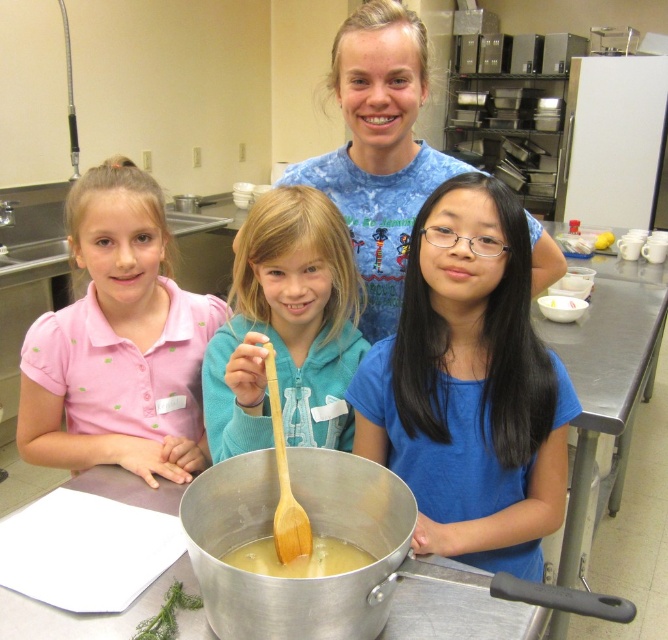
Is blue cotton shirt at upper center to the right of yellow matte liquid at center from the viewer's perspective?

Indeed, blue cotton shirt at upper center is positioned on the right side of yellow matte liquid at center.

Which is in front, point (411, 72) or point (277, 547)?

Point (277, 547) is more forward.

Identify the location of blue cotton shirt at upper center. (377, 148).

Does blue matte shirt at center appear over yellow matte cupcake at center?

No, blue matte shirt at center is not above yellow matte cupcake at center.

Does blue matte shirt at center lie behind yellow matte cupcake at center?

That is False.

Does point (385, 385) come behind point (599, 244)?

No, (385, 385) is in front of (599, 244).

Identify the location of blue matte shirt at center. (470, 387).

Who is positioned more to the right, yellow matte liquid at center or yellow matte cupcake at center?

From the viewer's perspective, yellow matte cupcake at center appears more on the right side.

Which is behind, point (349, 548) or point (605, 243)?

The point (605, 243) is more distant.

Locate an element on the screen. The width and height of the screenshot is (668, 640). yellow matte liquid at center is located at coordinates (299, 557).